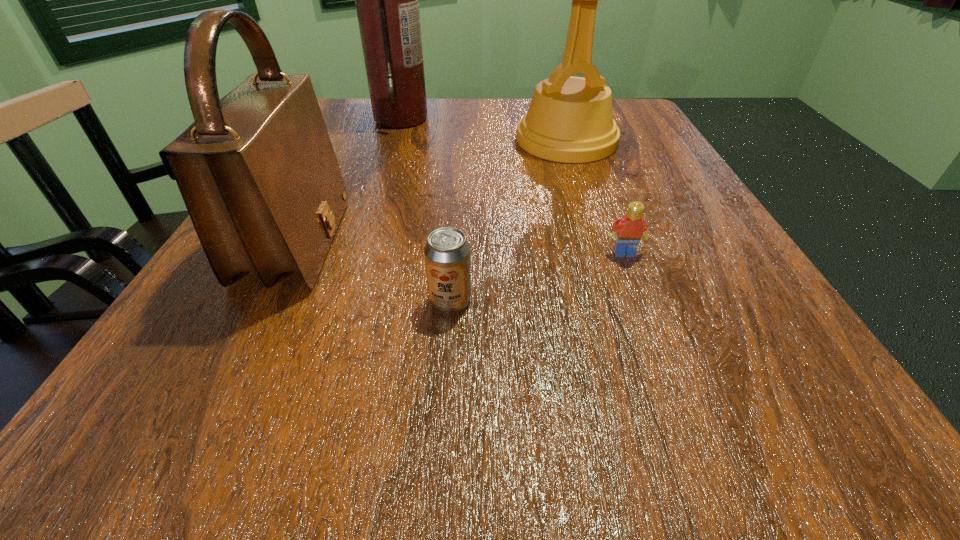
This screenshot has height=540, width=960. Identify the location of free space at the far left corner. (372, 107).

Where is `vacant space at the far right corner of the desktop`? The height and width of the screenshot is (540, 960). vacant space at the far right corner of the desktop is located at coordinates (639, 137).

Find the location of a particular element. The width and height of the screenshot is (960, 540). free point at the near right corner is located at coordinates (747, 442).

The width and height of the screenshot is (960, 540). What are the coordinates of `free space that is in between the third shortest object and the fire extinguisher` in the screenshot? It's located at (348, 180).

Find the location of a particular element. The width and height of the screenshot is (960, 540). vacant region between the award and the third object from left to right is located at coordinates (509, 220).

This screenshot has height=540, width=960. I want to click on free point between the award and the tallest object, so click(x=484, y=129).

Image resolution: width=960 pixels, height=540 pixels. I want to click on vacant area between the fire extinguisher and the shortest object, so tap(513, 185).

The width and height of the screenshot is (960, 540). Identify the location of vacant space that's between the award and the beer can. (509, 220).

Locate an element on the screen. unoccupied area between the fire extinguisher and the third shortest object is located at coordinates (348, 180).

The width and height of the screenshot is (960, 540). Find the location of `vacant area between the award and the third tallest object`. vacant area between the award and the third tallest object is located at coordinates (431, 191).